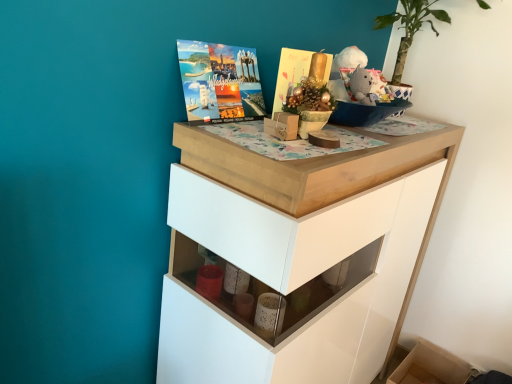
Find the location of `vacant space to the left of matte brown box at center`. vacant space to the left of matte brown box at center is located at coordinates (x=216, y=130).